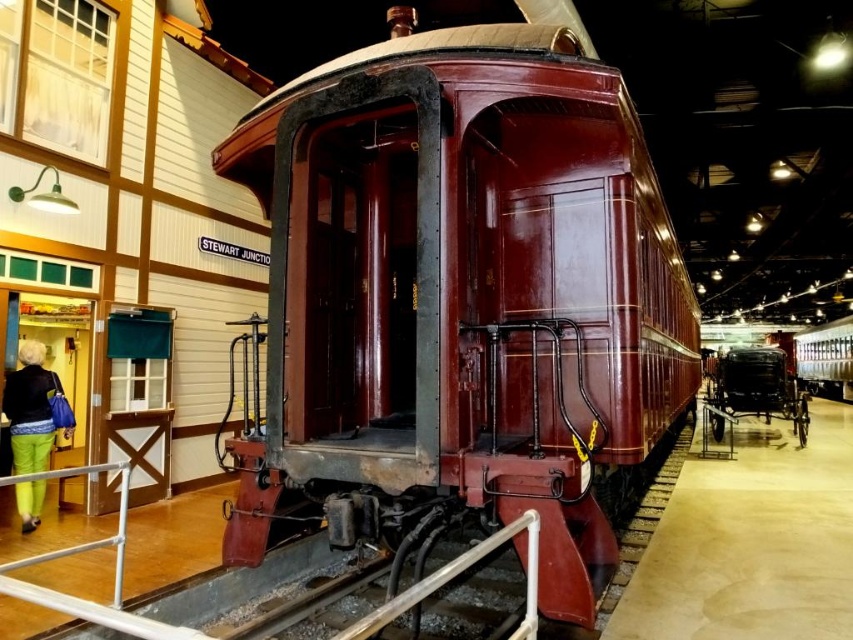
You are a museum guide explaining the exhibits to visitors. You need to mention both the shiny black carriage at center and the shiny silver train at right in your description. Which one is shorter?

The shiny black carriage at center is shorter than the shiny silver train at right.

Looking at this image, you are a museum visitor who wants to take a photo of the shiny black carriage at center without including the white metal rail at lower left in the frame. Is it possible to do so by moving sideways?

The shiny black carriage at center might be wider than white metal rail at lower left, so moving sideways may not be sufficient to exclude the rail from the frame. Adjust your position carefully or zoom in to focus solely on the carriage.

You are standing near the vintage train car and want to take a photo of the green fabric pants at lower left and the white metal rail at lower left. Which object should you focus on first if you want both to be in clear focus?

The green fabric pants at lower left is closer to the viewer than the white metal rail at lower left. To have both in clear focus, focus on the green fabric pants at lower left first since it is closer, ensuring the depth of field captures the rail behind it.